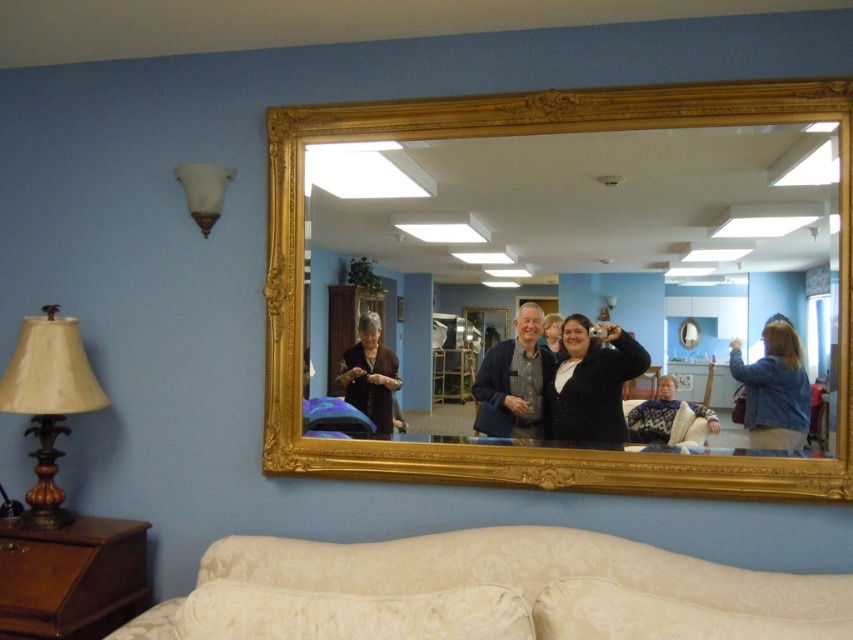
Question: Which point is farther to the camera?

Choices:
 (A) matte blue sweater at center
 (B) gold ornate mirror at upper center
 (C) creamy fabric couch at lower center
 (D) matte black sweater at center

Answer: (A)

Question: Which point is closer to the camera?

Choices:
 (A) denim jacket at lower right
 (B) creamy fabric couch at lower center

Answer: (B)

Question: Is gold ornate mirror at upper center further to the viewer compared to matte blue sweater at center?

Choices:
 (A) no
 (B) yes

Answer: (A)

Question: In this image, where is creamy fabric couch at lower center located relative to matte beige lampshade at left?

Choices:
 (A) left
 (B) right

Answer: (B)

Question: Is matte beige lampshade at left wider than denim jacket at lower right?

Choices:
 (A) yes
 (B) no

Answer: (A)

Question: Estimate the real-world distances between objects in this image. Which object is farther from the matte blue sweater at center?

Choices:
 (A) matte beige lampshade at left
 (B) matte brown sweater at center
 (C) matte black sweater at center

Answer: (A)